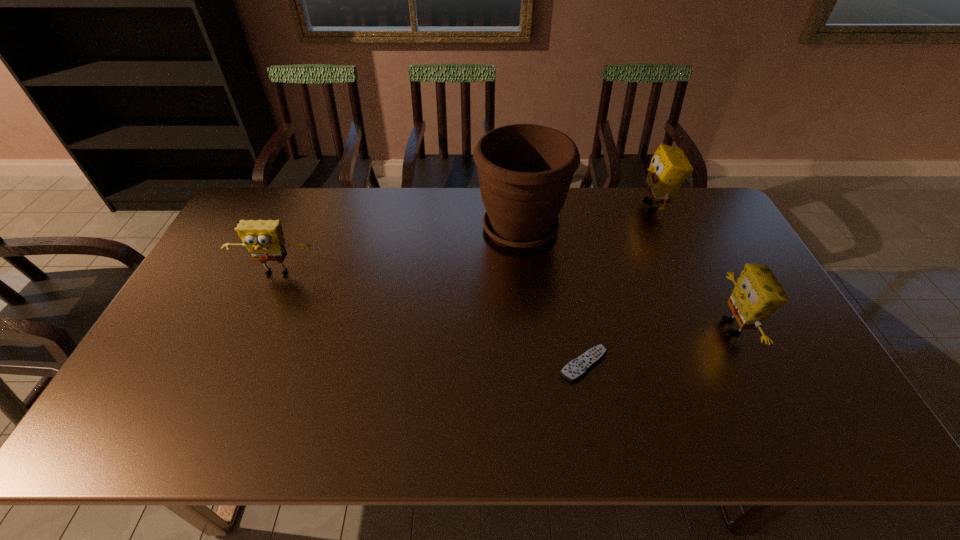
In the image, there is a desktop. Where is `vacant area at the near edge`? vacant area at the near edge is located at coordinates (368, 430).

In the image, there is a desktop. Identify the location of vacant space at the right edge. (731, 272).

Identify the location of vacant space at the far left corner of the desktop. This screenshot has height=540, width=960. (276, 199).

Locate an element on the screen. empty space between the nearest sponge and the farthest sponge is located at coordinates (693, 266).

You are a GUI agent. You are given a task and a screenshot of the screen. Output one action in this format:
    pyautogui.click(x=<x>, y=<y>)
    Task: Click on the free spot between the nearest sponge and the remote control
    The image size is (960, 540).
    Given the screenshot: What is the action you would take?
    pyautogui.click(x=658, y=346)

Locate an element on the screen. free space between the remote control and the tallest object is located at coordinates click(x=552, y=296).

You are a GUI agent. You are given a task and a screenshot of the screen. Output one action in this format:
    pyautogui.click(x=<x>, y=<y>)
    Task: Click on the free area in between the farthest sponge and the shortest object
    
    Given the screenshot: What is the action you would take?
    pyautogui.click(x=618, y=285)

I want to click on vacant area between the flowerpot and the shortest object, so click(x=552, y=296).

At what (x,y) coordinates should I click in order to perform the action: click on vacant area that lies between the farthest sponge and the second farthest sponge. Please return your answer as a coordinate pair (x, y). The image size is (960, 540). Looking at the image, I should click on (465, 240).

Find the location of a particular element. empty space that is in between the nearest sponge and the tallest object is located at coordinates pos(626,278).